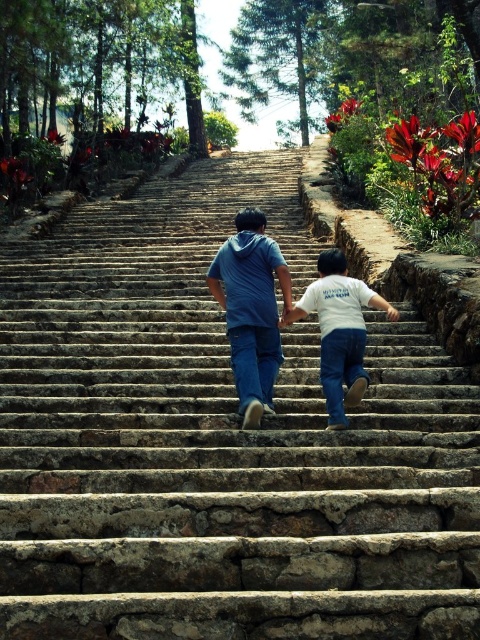
Question: Considering the real-world distances, which object is closest to the matte blue hoodie at center?

Choices:
 (A) white cotton shirt at center
 (B) blue denim jeans at center

Answer: (B)

Question: Is blue denim jeans at center to the left of white cotton shirt at center from the viewer's perspective?

Choices:
 (A) yes
 (B) no

Answer: (A)

Question: Is matte blue hoodie at center behind white cotton shirt at center?

Choices:
 (A) no
 (B) yes

Answer: (A)

Question: Which point appears farthest from the camera in this image?

Choices:
 (A) (278, 250)
 (B) (347, 404)

Answer: (A)

Question: Which of the following is the closest to the observer?

Choices:
 (A) white cotton shirt at center
 (B) blue denim jeans at center
 (C) matte blue hoodie at center

Answer: (C)

Question: Is matte blue hoodie at center above white cotton shirt at center?

Choices:
 (A) no
 (B) yes

Answer: (A)